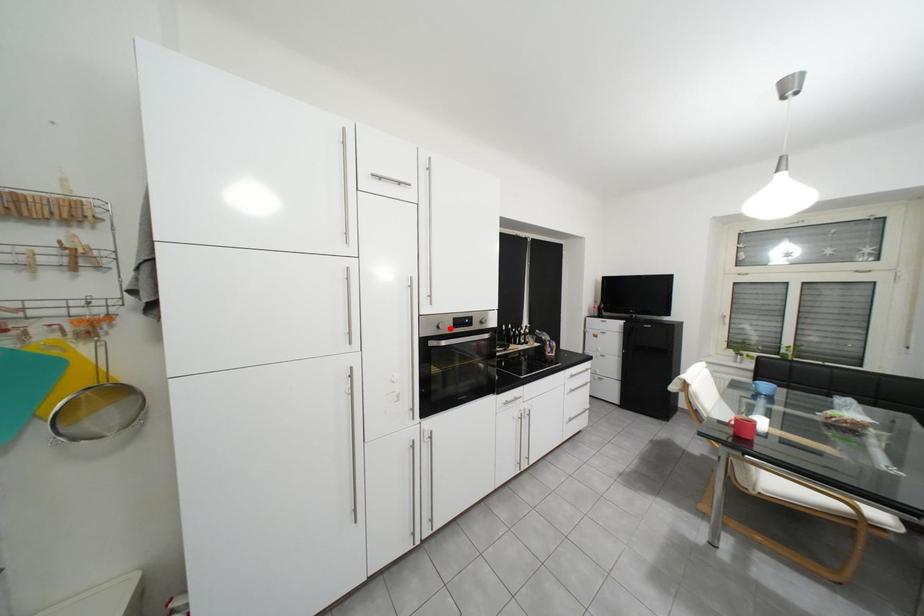
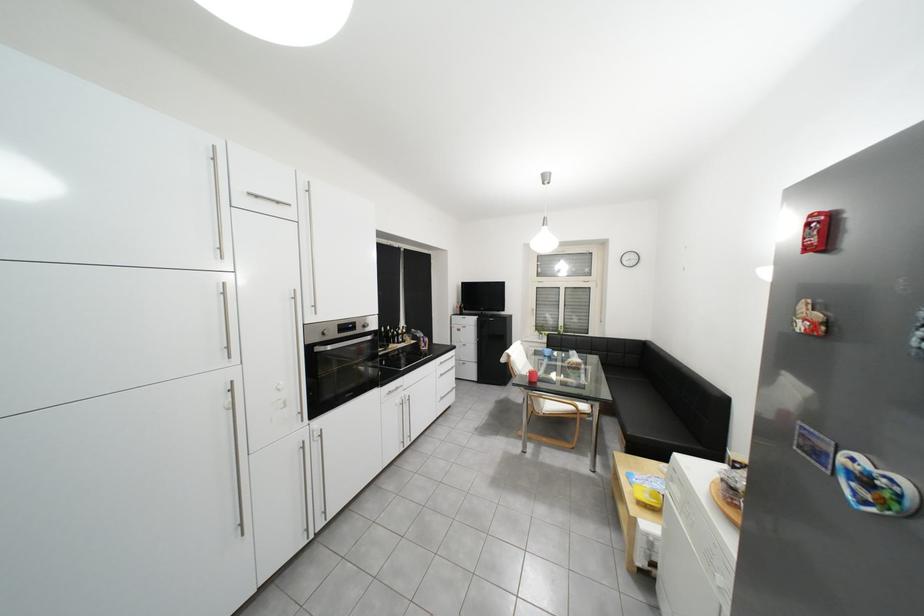
Where in the second image is the point corresponding to the highlighted location from the first image?

(334, 334)